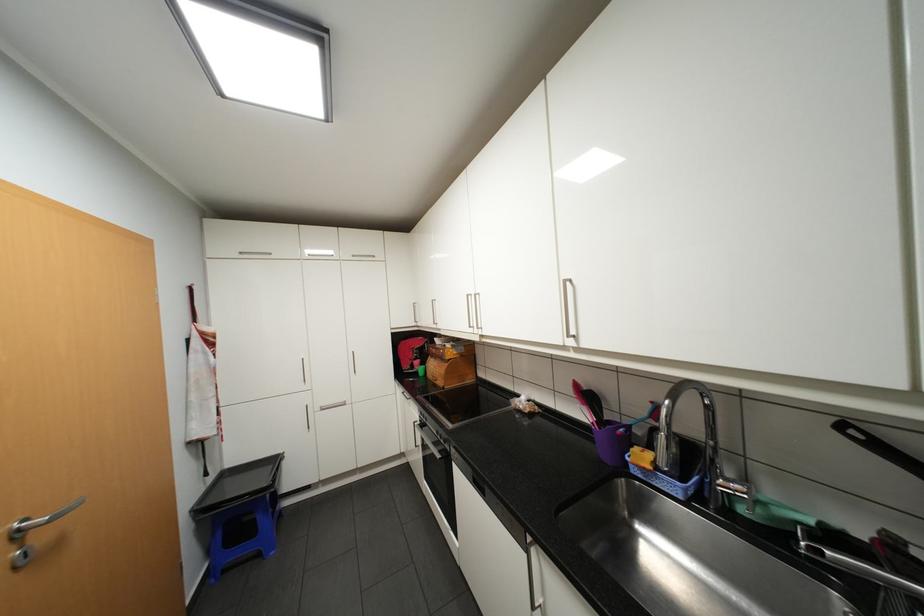
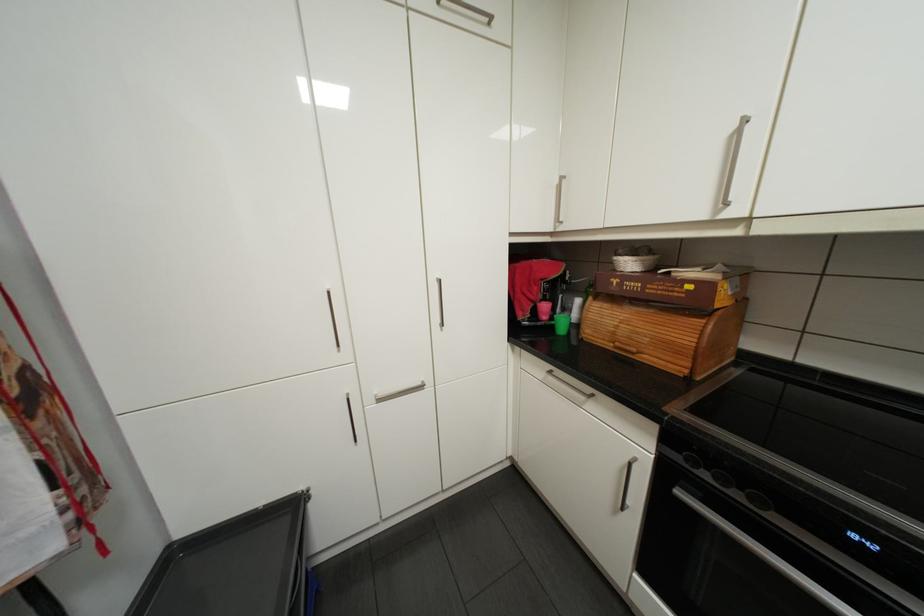
In a continuous first-person perspective shot, in which direction is the camera moving?

The movement direction of the cameraman is left, forward.